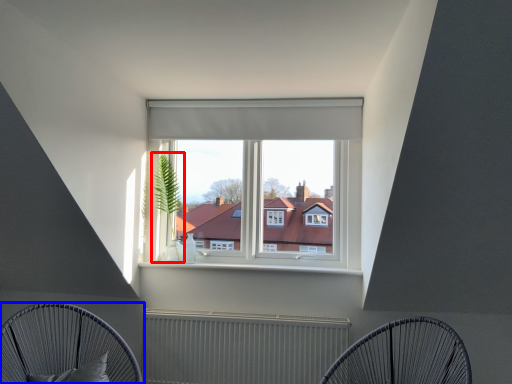
Question: Which object appears closest to the camera in this image, plant (highlighted by a red box) or furniture (highlighted by a blue box)?

Choices:
 (A) plant
 (B) furniture

Answer: (B)